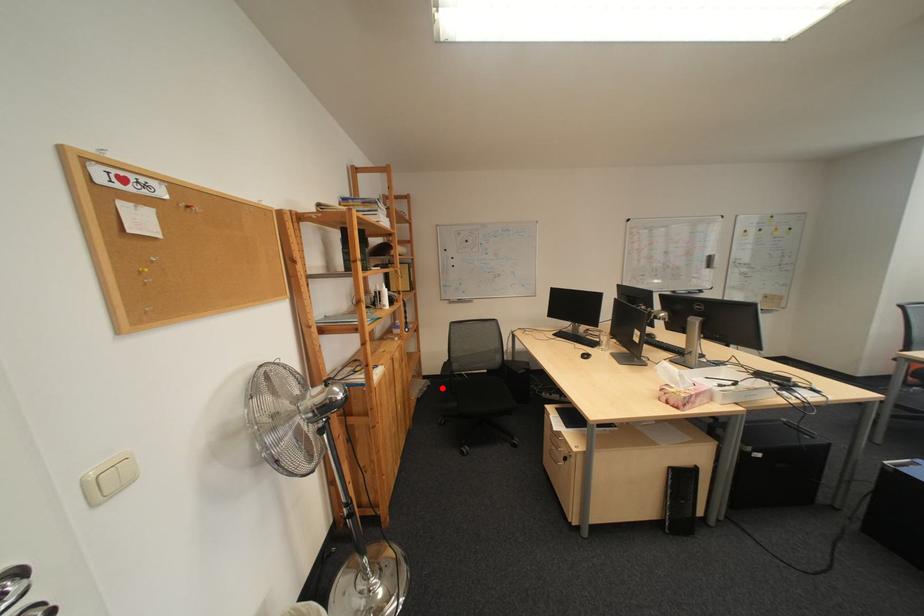
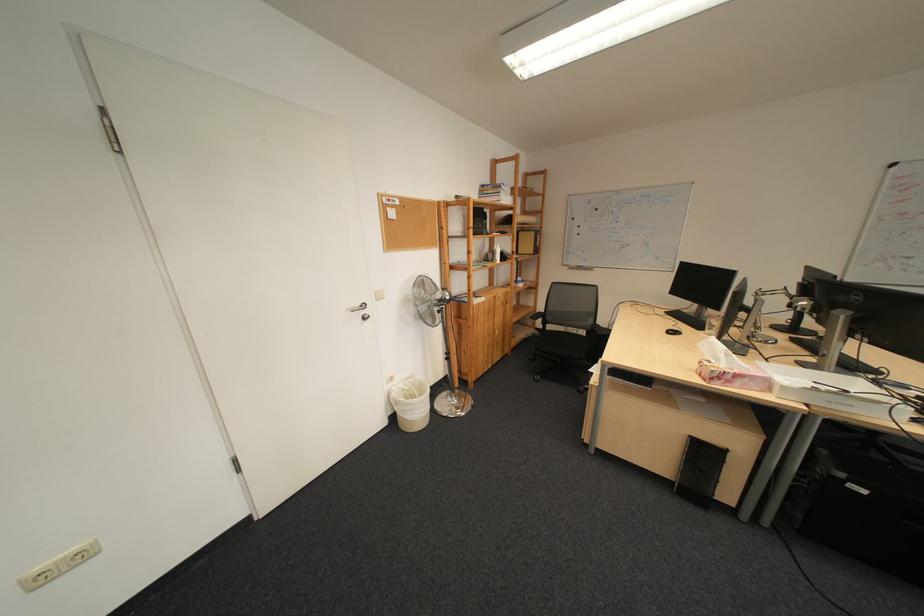
In the second image, find the point that corresponds to the highlighted location in the first image.

(548, 336)